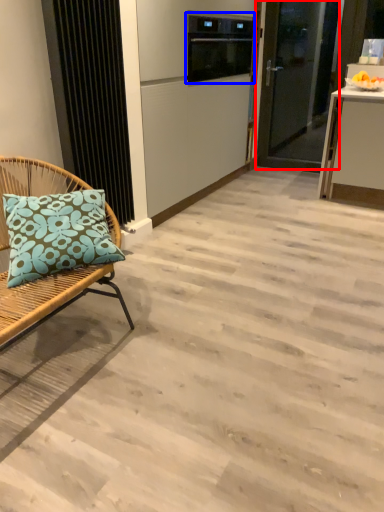
Question: Which object appears closest to the camera in this image, door (highlighted by a red box) or appliance (highlighted by a blue box)?

Choices:
 (A) door
 (B) appliance

Answer: (B)